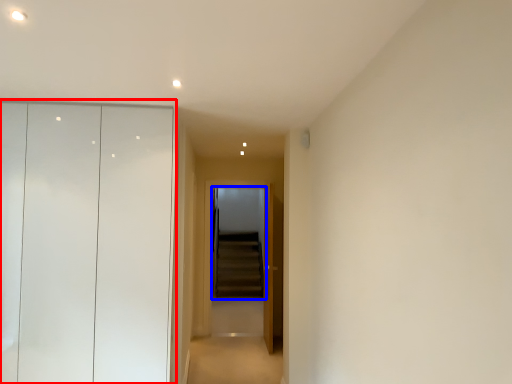
Question: Which point is further to the camera, dresser (highlighted by a red box) or screen door (highlighted by a blue box)?

Choices:
 (A) dresser
 (B) screen door

Answer: (B)